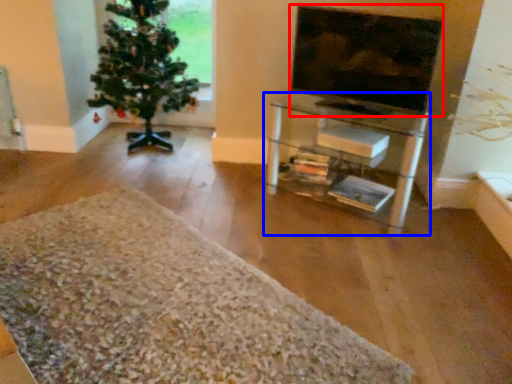
Question: Among these objects, which one is farthest to the camera, television (highlighted by a red box) or shelf (highlighted by a blue box)?

Choices:
 (A) television
 (B) shelf

Answer: (B)